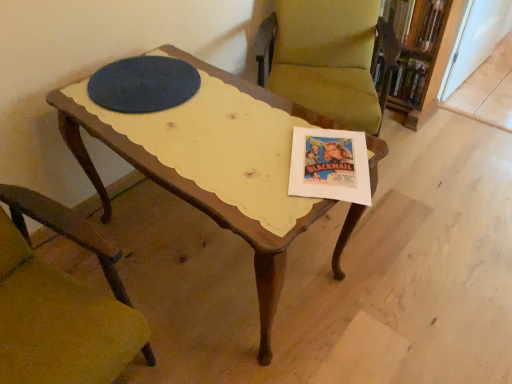
Question: Considering the relative sizes of wooden bookcase at upper right and hardcover book at upper right in the image provided, is wooden bookcase at upper right shorter than hardcover book at upper right?

Choices:
 (A) yes
 (B) no

Answer: (B)

Question: Is wooden bookcase at upper right smaller than hardcover book at upper right?

Choices:
 (A) yes
 (B) no

Answer: (B)

Question: Is wooden bookcase at upper right bigger than hardcover book at upper right?

Choices:
 (A) yes
 (B) no

Answer: (A)

Question: Is wooden bookcase at upper right touching hardcover book at upper right?

Choices:
 (A) no
 (B) yes

Answer: (B)

Question: Is wooden bookcase at upper right far from hardcover book at upper right?

Choices:
 (A) no
 (B) yes

Answer: (A)

Question: Do you think hardcover book at upper right is within wooden bookcase at upper right, or outside of it?

Choices:
 (A) outside
 (B) inside

Answer: (B)

Question: Considering the relative positions of hardcover book at upper right and wooden bookcase at upper right in the image provided, is hardcover book at upper right to the left or to the right of wooden bookcase at upper right?

Choices:
 (A) left
 (B) right

Answer: (A)

Question: Looking at the image, does hardcover book at upper right seem bigger or smaller compared to wooden bookcase at upper right?

Choices:
 (A) small
 (B) big

Answer: (A)

Question: Considering their positions, is hardcover book at upper right located in front of or behind wooden bookcase at upper right?

Choices:
 (A) front
 (B) behind

Answer: (B)

Question: Would you say velvet green chair at center, which is the 2th chair from bottom to top, is to the left or to the right of wooden chair at lower left, the 2th chair viewed from the back, in the picture?

Choices:
 (A) right
 (B) left

Answer: (A)

Question: From the image's perspective, is velvet green chair at center, the 2th chair viewed from the front, located above or below wooden chair at lower left, arranged as the 1th chair when viewed from the left?

Choices:
 (A) above
 (B) below

Answer: (A)

Question: Looking at their shapes, would you say velvet green chair at center, which is the 2th chair from bottom to top, is wider or thinner than wooden chair at lower left, arranged as the 1th chair when viewed from the left?

Choices:
 (A) wide
 (B) thin

Answer: (A)

Question: Is point (331, 46) closer or farther from the camera than point (102, 299)?

Choices:
 (A) farther
 (B) closer

Answer: (A)

Question: Would you say velvet green chair at center, which is the 2th chair from bottom to top, is inside or outside hardcover book at upper right?

Choices:
 (A) outside
 (B) inside

Answer: (A)

Question: Considering the positions of velvet green chair at center, positioned as the 1th chair in top-to-bottom order, and hardcover book at upper right in the image, is velvet green chair at center, positioned as the 1th chair in top-to-bottom order, taller or shorter than hardcover book at upper right?

Choices:
 (A) short
 (B) tall

Answer: (B)